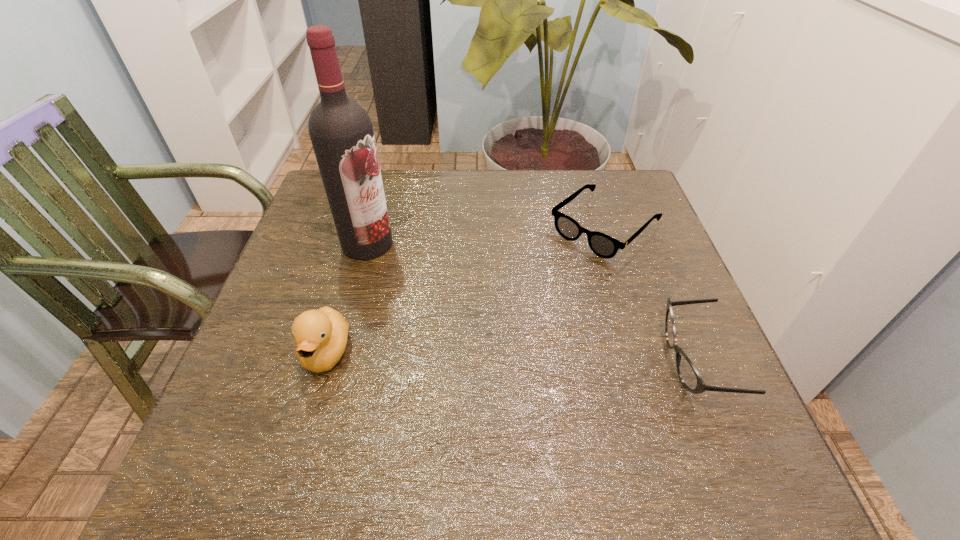
The width and height of the screenshot is (960, 540). I want to click on vacant region located on the label of the tallest object, so click(x=458, y=329).

Find the location of `vacant region located on the arms of the farther spectacles`. vacant region located on the arms of the farther spectacles is located at coordinates (551, 275).

The image size is (960, 540). Identify the location of free space located on the arms of the farther spectacles. (529, 295).

The image size is (960, 540). Find the location of `free location located 0.150m on the arms of the farther spectacles`. free location located 0.150m on the arms of the farther spectacles is located at coordinates (535, 290).

You are a GUI agent. You are given a task and a screenshot of the screen. Output one action in this format:
    pyautogui.click(x=<x>, y=<y>)
    Task: Click on the object present at the far edge
    
    Given the screenshot: What is the action you would take?
    pyautogui.click(x=603, y=245)

Find the location of `object that is at the near edge`. object that is at the near edge is located at coordinates (689, 376).

Find the location of a particular element. The image size is (960, 540). duckling that is at the left edge is located at coordinates (321, 335).

I want to click on wine bottle present at the left edge, so click(341, 132).

This screenshot has width=960, height=540. Find the location of `object at the far right corner`. object at the far right corner is located at coordinates (603, 245).

Locate an element on the screen. object present at the near right corner is located at coordinates (689, 376).